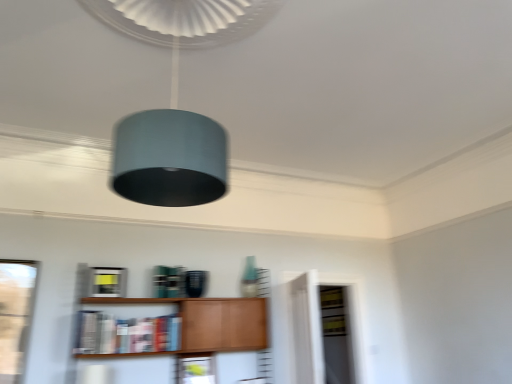
Question: Does matte wood cabinet at lower center have a lesser width compared to wooden shelf at lower center?

Choices:
 (A) no
 (B) yes

Answer: (B)

Question: Considering the relative positions of matte wood cabinet at lower center and wooden shelf at lower center in the image provided, is matte wood cabinet at lower center to the left of wooden shelf at lower center from the viewer's perspective?

Choices:
 (A) no
 (B) yes

Answer: (B)

Question: Is matte wood cabinet at lower center wider than wooden shelf at lower center?

Choices:
 (A) yes
 (B) no

Answer: (B)

Question: From a real-world perspective, is matte wood cabinet at lower center on wooden shelf at lower center?

Choices:
 (A) no
 (B) yes

Answer: (B)

Question: Can we say matte wood cabinet at lower center lies outside wooden shelf at lower center?

Choices:
 (A) no
 (B) yes

Answer: (B)

Question: From a real-world perspective, is transparent glass door at center physically located above or below teal fabric lampshade at upper center?

Choices:
 (A) below
 (B) above

Answer: (A)

Question: In terms of width, does transparent glass door at center look wider or thinner when compared to teal fabric lampshade at upper center?

Choices:
 (A) thin
 (B) wide

Answer: (A)

Question: Considering the positions of point (291, 304) and point (195, 125), is point (291, 304) closer or farther from the camera than point (195, 125)?

Choices:
 (A) farther
 (B) closer

Answer: (A)

Question: Would you say transparent glass door at center is inside or outside teal fabric lampshade at upper center?

Choices:
 (A) inside
 (B) outside

Answer: (B)

Question: Looking at their shapes, would you say matte wood cabinet at lower center is wider or thinner than teal fabric lampshade at upper center?

Choices:
 (A) wide
 (B) thin

Answer: (B)

Question: From the image's perspective, is matte wood cabinet at lower center positioned above or below teal fabric lampshade at upper center?

Choices:
 (A) below
 (B) above

Answer: (A)

Question: In the image, is matte wood cabinet at lower center on the left side or the right side of teal fabric lampshade at upper center?

Choices:
 (A) right
 (B) left

Answer: (B)

Question: Relative to teal fabric lampshade at upper center, is matte wood cabinet at lower center in front or behind?

Choices:
 (A) behind
 (B) front

Answer: (A)

Question: From the image's perspective, relative to teal fabric lampshade at upper center, is wooden shelf at lower center above or below?

Choices:
 (A) above
 (B) below

Answer: (B)

Question: In terms of height, does wooden shelf at lower center look taller or shorter compared to teal fabric lampshade at upper center?

Choices:
 (A) tall
 (B) short

Answer: (B)